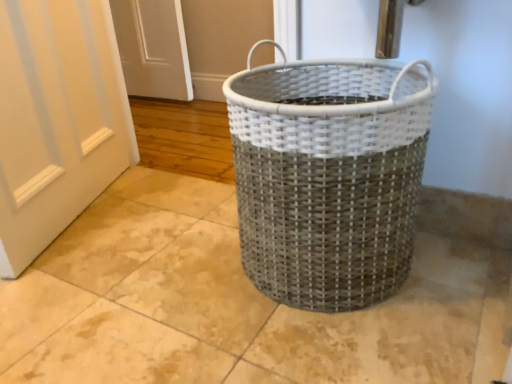
What do you see at coordinates (57, 120) in the screenshot? I see `white painted wood door at left` at bounding box center [57, 120].

The width and height of the screenshot is (512, 384). I want to click on white painted wood door at left, so [57, 120].

The image size is (512, 384). I want to click on white woven basket at center, so click(x=328, y=176).

The width and height of the screenshot is (512, 384). What do you see at coordinates (328, 176) in the screenshot? I see `white woven basket at center` at bounding box center [328, 176].

I want to click on white painted wood door at left, so click(x=57, y=120).

In the scene shown: Does white woven basket at center appear on the right side of white painted wood door at left?

Yes, white woven basket at center is to the right of white painted wood door at left.

Considering the positions of objects white woven basket at center and white painted wood door at left in the image provided, who is behind, white woven basket at center or white painted wood door at left?

white painted wood door at left.

Which point is more forward, [279,154] or [37,196]?

The point [279,154] is in front.

From the image's perspective, relative to white painted wood door at left, is white woven basket at center above or below?

white woven basket at center is situated lower than white painted wood door at left in the image.

From a real-world perspective, which object stands above the other?

white painted wood door at left, from a real-world perspective.

Is white woven basket at center wider than white painted wood door at left?

Yes.

Is white woven basket at center shorter than white painted wood door at left?

Yes.

Considering the sizes of objects white woven basket at center and white painted wood door at left in the image provided, who is bigger, white woven basket at center or white painted wood door at left?

Bigger between the two is white woven basket at center.

Would you say white woven basket at center is outside white painted wood door at left?

white woven basket at center lies outside white painted wood door at left's area.

Are white woven basket at center and white painted wood door at left making contact?

white woven basket at center and white painted wood door at left are not in contact.

Is white woven basket at center facing away from white painted wood door at left?

No, white woven basket at center's orientation is not away from white painted wood door at left.

Can you tell me how much white woven basket at center and white painted wood door at left differ in facing direction?

112 degrees.

How distant is white woven basket at center from white painted wood door at left?

The distance of white woven basket at center from white painted wood door at left is 29.57 inches.

You are a GUI agent. You are given a task and a screenshot of the screen. Output one action in this format:
    pyautogui.click(x=<x>, y=<y>)
    Task: Click on the waste container below the white painted wood door at left (from a real-world perspective)
    
    Given the screenshot: What is the action you would take?
    pyautogui.click(x=328, y=176)

Based on the photo, can you confirm if white painted wood door at left is positioned to the left of white woven basket at center?

Indeed, white painted wood door at left is positioned on the left side of white woven basket at center.

Looking at this image, is white painted wood door at left closer to the viewer compared to white woven basket at center?

No, white painted wood door at left is behind white woven basket at center.

Considering the positions of point (111, 35) and point (324, 225), is point (111, 35) closer or farther from the camera than point (324, 225)?

Point (111, 35) is farther from the camera than point (324, 225).

In the scene shown: From the image's perspective, which object appears higher, white painted wood door at left or white woven basket at center?

From the image's view, white painted wood door at left is above.

From a real-world perspective, is white painted wood door at left located higher than white woven basket at center?

Correct, in the physical world, white painted wood door at left is higher than white woven basket at center.

Based on the photo, which object is wider, white painted wood door at left or white woven basket at center?

white woven basket at center is wider.

Considering the sizes of objects white painted wood door at left and white woven basket at center in the image provided, who is shorter, white painted wood door at left or white woven basket at center?

Standing shorter between the two is white woven basket at center.

Considering the relative sizes of white painted wood door at left and white woven basket at center in the image provided, is white painted wood door at left bigger than white woven basket at center?

No, white painted wood door at left is not bigger than white woven basket at center.

Is white painted wood door at left completely or partially outside of white woven basket at center?

→ Yes, white painted wood door at left is located beyond the bounds of white woven basket at center.

Are white painted wood door at left and white woven basket at center making contact?

They are not placed beside each other.

Is white painted wood door at left oriented towards white woven basket at center?

Yes.

Measure the distance from white painted wood door at left to white woven basket at center.

29.57 inches.

You are a GUI agent. You are given a task and a screenshot of the screen. Output one action in this format:
    pyautogui.click(x=<x>, y=<y>)
    Task: Click on the waste container below the white painted wood door at left (from the image's perspective)
    This screenshot has height=384, width=512.
    Given the screenshot: What is the action you would take?
    pyautogui.click(x=328, y=176)

Find the location of `door above the white woven basket at center (from a real-world perspective)`. door above the white woven basket at center (from a real-world perspective) is located at coordinates (57, 120).

You are a GUI agent. You are given a task and a screenshot of the screen. Output one action in this format:
    pyautogui.click(x=<x>, y=<y>)
    Task: Click on the waste container on the right of white painted wood door at left
    The height and width of the screenshot is (384, 512).
    Given the screenshot: What is the action you would take?
    pyautogui.click(x=328, y=176)